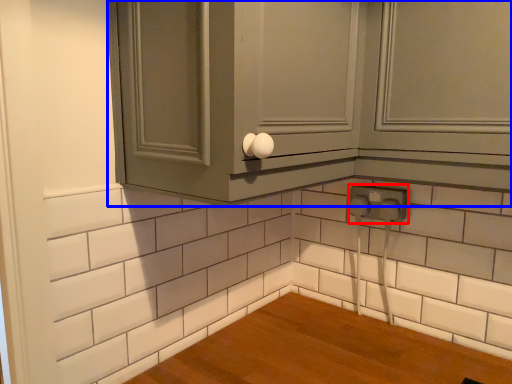
Question: Which point is further to the camera, electric outlet (highlighted by a red box) or cabinetry (highlighted by a blue box)?

Choices:
 (A) electric outlet
 (B) cabinetry

Answer: (A)